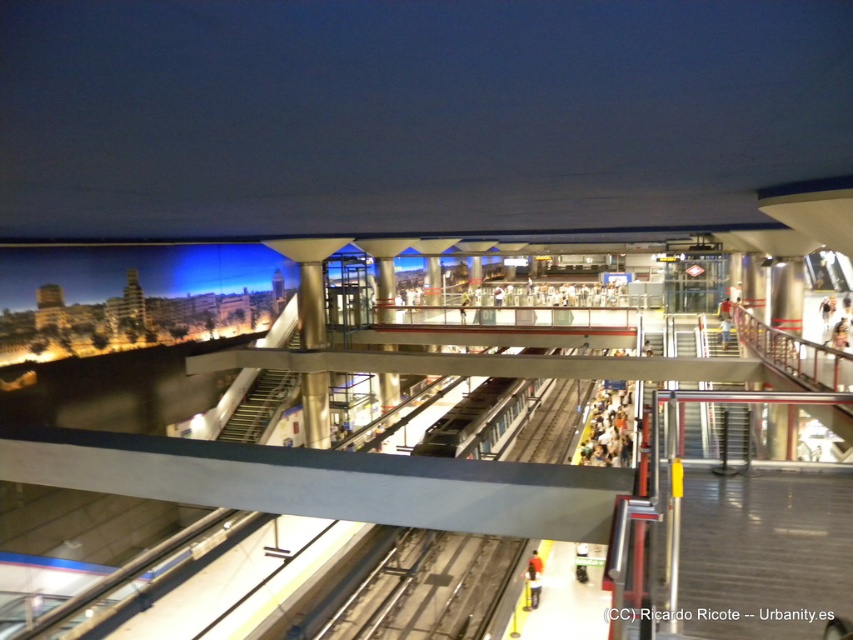
At what (x,y) coordinates should I click in order to perform the action: click on matte black crowd at lower center. Please return your answer as a coordinate pair (x, y). Looking at the image, I should click on click(607, 428).

At what (x,y) coordinates should I click in order to perform the action: click on matte black crowd at lower center. Please return your answer as a coordinate pair (x, y). Image resolution: width=853 pixels, height=640 pixels. Looking at the image, I should click on (607, 428).